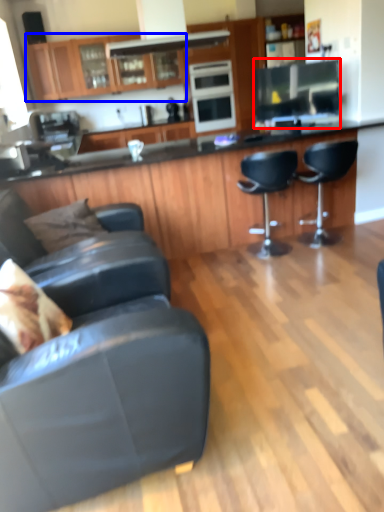
Question: Which object appears farthest to the camera in this image, appliance (highlighted by a red box) or cabinetry (highlighted by a blue box)?

Choices:
 (A) appliance
 (B) cabinetry

Answer: (B)